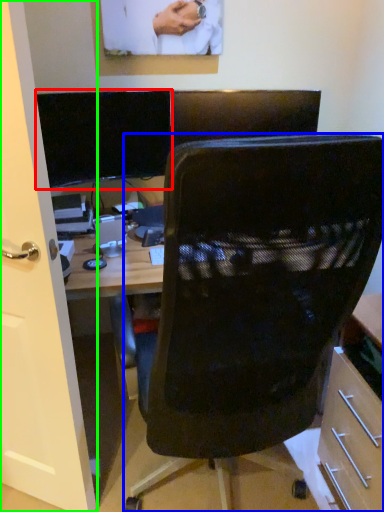
Question: Estimate the real-world distances between objects in this image. Which object is farther from computer monitor (highlighted by a red box), chair (highlighted by a blue box) or glass door (highlighted by a green box)?

Choices:
 (A) chair
 (B) glass door

Answer: (A)